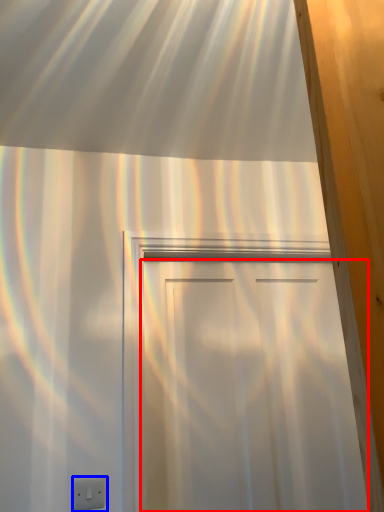
Question: Which object appears closest to the camera in this image, door (highlighted by a red box) or electric outlet (highlighted by a blue box)?

Choices:
 (A) door
 (B) electric outlet

Answer: (B)